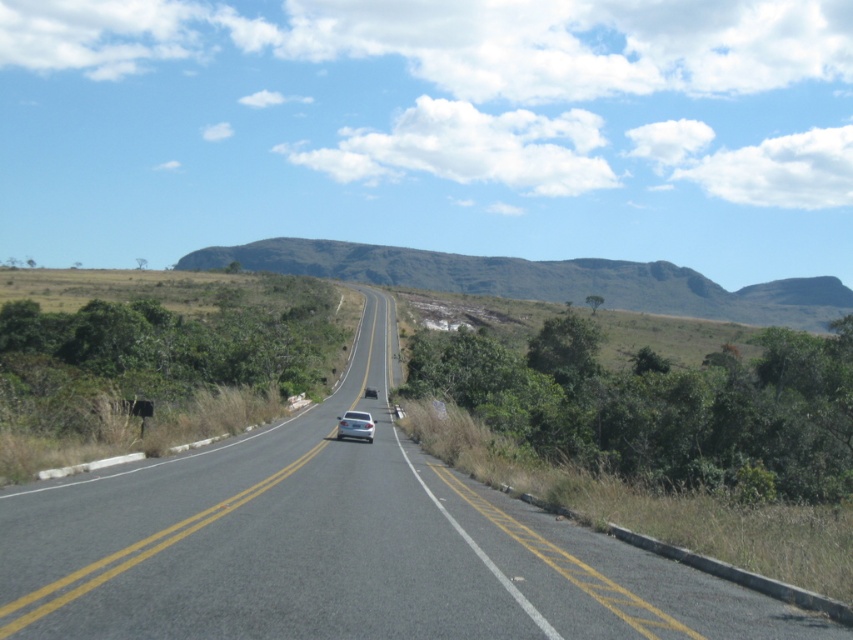
You are a delivery driver navigating a two lane road. You need to deliver a package to a location marked by the point at coordinates (339,545). Based on the scene, where should you drive to reach that point?

The point at coordinates (339,545) is on the asphalt road at center, so you should drive along the asphalt road towards the center to reach that point.

You are a photographer standing at the starting point of the road. You want to take a picture of both point (x=415, y=257) and point (x=370, y=419) in the frame. Which point will appear closer to the bottom edge of your camera view?

Point (x=370, y=419) will appear closer to the bottom edge of the camera view because it is closer to the camera than point (x=415, y=257).